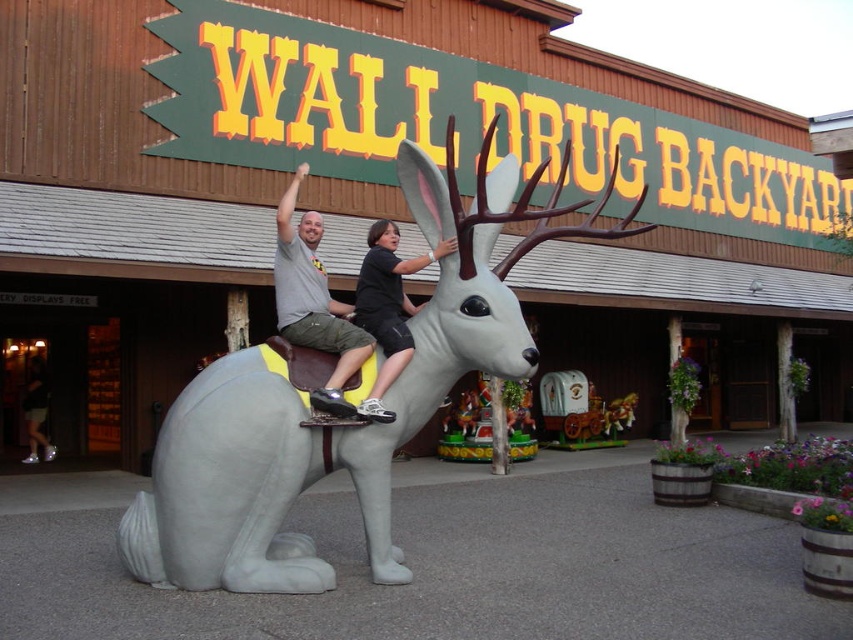
Between gray matte deer at center and matte gray rabbit at center, which one has more height?

Standing taller between the two is gray matte deer at center.

Between gray matte deer at center and matte gray rabbit at center, which one has less height?

Standing shorter between the two is matte gray rabbit at center.

The image size is (853, 640). I want to click on gray matte deer at center, so click(340, 422).

Does matte gray rabbit at center have a lesser width compared to black matte shirt at center?

No.

Does matte gray rabbit at center have a greater width compared to black matte shirt at center?

Yes.

Between point (310, 234) and point (419, 257), which one is positioned in front?

Point (419, 257) is more forward.

This screenshot has height=640, width=853. In order to click on matte gray rabbit at center in this screenshot , I will do `click(312, 301)`.

Is gray matte deer at center wider than black matte shirt at center?

Correct, the width of gray matte deer at center exceeds that of black matte shirt at center.

Measure the distance from gray matte deer at center to black matte shirt at center.

A distance of 25.14 inches exists between gray matte deer at center and black matte shirt at center.

You are a GUI agent. You are given a task and a screenshot of the screen. Output one action in this format:
    pyautogui.click(x=<x>, y=<y>)
    Task: Click on the gray matte deer at center
    The width and height of the screenshot is (853, 640).
    Given the screenshot: What is the action you would take?
    pyautogui.click(x=340, y=422)